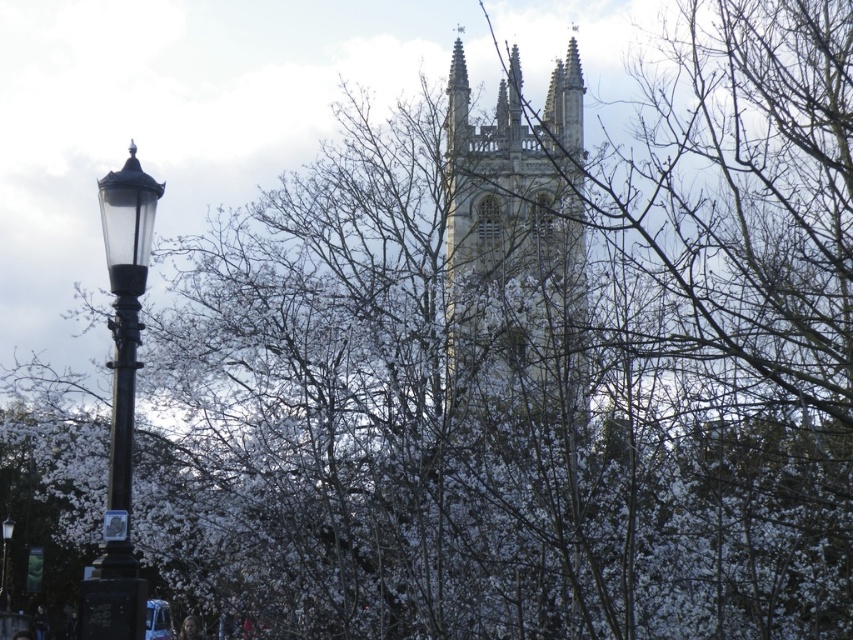
Question: Is white stone church at upper center to the right of black glass street light at left from the viewer's perspective?

Choices:
 (A) no
 (B) yes

Answer: (B)

Question: Which is farther from the polished black lamp post at left?

Choices:
 (A) white stone church at upper center
 (B) black glass street light at left

Answer: (A)

Question: Considering the real-world distances, which object is farthest from the black glass street light at left?

Choices:
 (A) polished black lamp post at left
 (B) white stone church at upper center

Answer: (B)

Question: Considering the relative positions of white stone church at upper center and polished black lamp post at left in the image provided, where is white stone church at upper center located with respect to polished black lamp post at left?

Choices:
 (A) above
 (B) below

Answer: (A)

Question: Which point is closer to the camera?

Choices:
 (A) polished black lamp post at left
 (B) black glass street light at left

Answer: (A)

Question: Can you confirm if polished black lamp post at left is bigger than black glass street light at left?

Choices:
 (A) no
 (B) yes

Answer: (B)